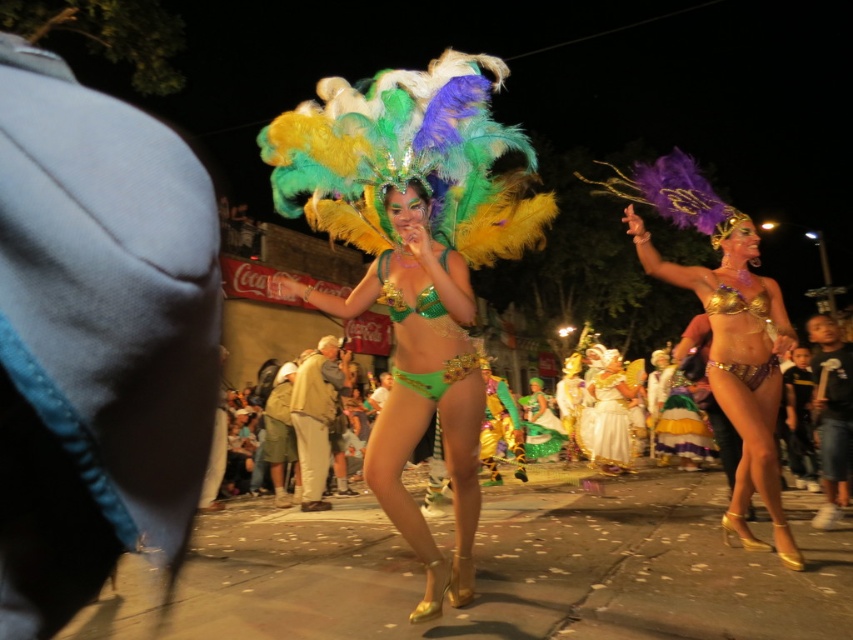
Is point (410, 225) positioned in front of point (541, 381)?

That is True.

Is green metallic bikini at center above shiny green bikini at center?

Indeed, green metallic bikini at center is positioned over shiny green bikini at center.

Find the location of `green metallic bikini at center`. green metallic bikini at center is located at coordinates (421, 384).

I want to click on green metallic bikini at center, so click(x=421, y=384).

Which is in front, point (614, 394) or point (740, 355)?

Point (740, 355) is more forward.

Does gold sequined dress at center lie in front of gold metallic bikini at center?

No, it is not.

Describe the element at coordinates (607, 413) in the screenshot. I see `gold sequined dress at center` at that location.

At what (x,y) coordinates should I click in order to perform the action: click on gold sequined dress at center. Please return your answer as a coordinate pair (x, y). Looking at the image, I should click on (607, 413).

Can you confirm if green metallic bikini at center is thinner than green sequined bikini at center?

In fact, green metallic bikini at center might be wider than green sequined bikini at center.

Consider the image. Does green metallic bikini at center appear on the right side of green sequined bikini at center?

No, green metallic bikini at center is not to the right of green sequined bikini at center.

Between point (469, 481) and point (395, 312), which one is positioned behind?

The point (395, 312) is more distant.

This screenshot has width=853, height=640. Find the location of `green metallic bikini at center`. green metallic bikini at center is located at coordinates (421, 384).